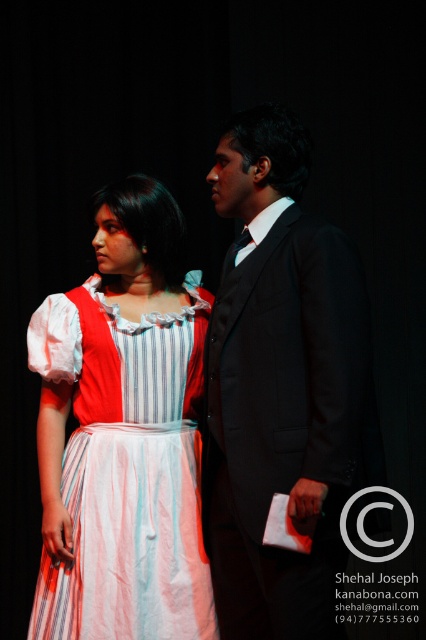
Based on the photo, can you confirm if black satin suit at center is positioned to the right of striped cotton dress at center?

Correct, you'll find black satin suit at center to the right of striped cotton dress at center.

Does black satin suit at center appear over striped cotton dress at center?

Indeed, black satin suit at center is positioned over striped cotton dress at center.

Is point (249, 218) positioned behind point (141, 401)?

No, (249, 218) is closer to viewer.

This screenshot has height=640, width=426. In order to click on black satin suit at center in this screenshot , I will do `click(281, 387)`.